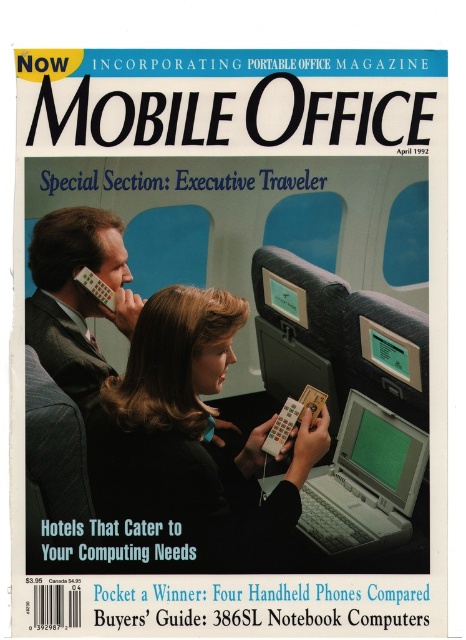
Which of these two, matte black laptop at center or gray plastic laptop at center, stands taller?

With more height is matte black laptop at center.

Is point (198, 356) positioned in front of point (370, 419)?

That is True.

At what (x,y) coordinates should I click in order to perform the action: click on matte black laptop at center. Please return your answer as a coordinate pair (x, y). The height and width of the screenshot is (640, 466). Looking at the image, I should click on (193, 432).

Can you confirm if matte black laptop at center is shorter than matte gray suit at left?

In fact, matte black laptop at center may be taller than matte gray suit at left.

Looking at this image, who is taller, matte black laptop at center or matte gray suit at left?

Standing taller between the two is matte black laptop at center.

I want to click on matte black laptop at center, so click(x=193, y=432).

Between point (73, 292) and point (370, 412), which one is positioned in front?

Point (370, 412) is more forward.

Between matte gray suit at left and gray plastic laptop at center, which one has more height?

matte gray suit at left

Which is behind, point (25, 330) or point (323, 522)?

Point (25, 330)

The height and width of the screenshot is (640, 466). I want to click on matte gray suit at left, so click(x=76, y=296).